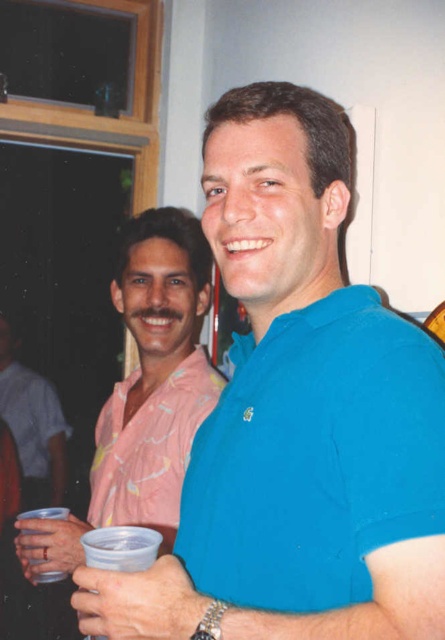
From the picture: Who is taller, matte pink shirt at center or matte plastic cup at lower left?

matte pink shirt at center is taller.

Is point (32, 387) in front of point (51, 554)?

No.

Where is `matte pink shirt at center`? The image size is (445, 640). matte pink shirt at center is located at coordinates (32, 426).

Does point (294, 364) come behind point (154, 518)?

That is False.

Find the location of a particular element. blue cotton shirt at center is located at coordinates (296, 417).

Between point (356, 308) and point (169, 573), which one is positioned in front?

Point (169, 573)

Is point (338, 440) closer to viewer compared to point (112, 624)?

No, (338, 440) is further to viewer.

Who is more forward, (258, 467) or (83, 605)?

Positioned in front is point (83, 605).

Find the location of a particular element. Image resolution: width=445 pixels, height=640 pixels. matte blue polo shirt at center is located at coordinates (315, 458).